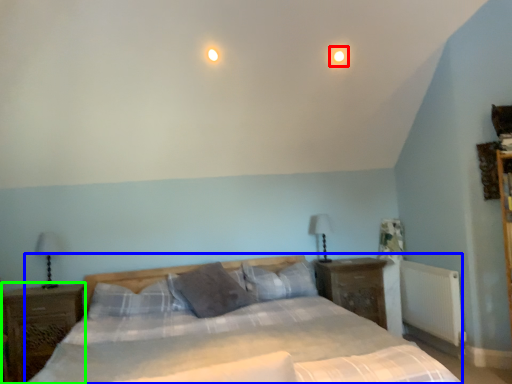
Question: Which is farther away from light (highlighted by a red box)? bed (highlighted by a blue box) or nightstand (highlighted by a green box)?

Choices:
 (A) bed
 (B) nightstand

Answer: (B)